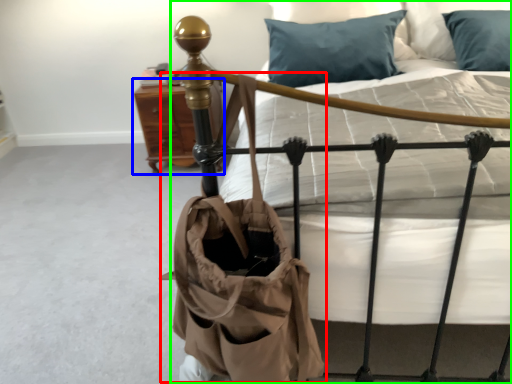
Question: Based on their relative distances, which object is nearer to shoulder bag (highlighted by a red box)? Choose from nightstand (highlighted by a blue box) and bed (highlighted by a green box).

Choices:
 (A) nightstand
 (B) bed

Answer: (B)